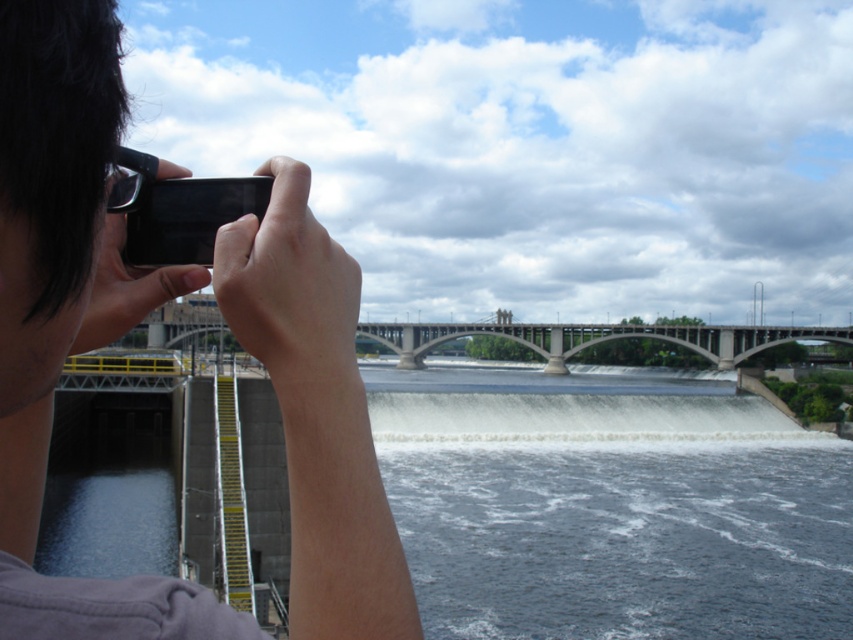
Question: In this image, where is matte black phone at upper left located relative to concrete bridge at center?

Choices:
 (A) above
 (B) below

Answer: (B)

Question: Which point appears farthest from the camera in this image?

Choices:
 (A) (49, 90)
 (B) (734, 356)

Answer: (B)

Question: Which point is closer to the camera taking this photo?

Choices:
 (A) (276, 220)
 (B) (131, 216)
 (C) (625, 328)

Answer: (A)

Question: Which object appears closest to the camera in this image?

Choices:
 (A) matte black phone at upper left
 (B) concrete bridge at center
 (C) black matte smartphone at upper left

Answer: (A)

Question: Does matte black phone at upper left appear on the right side of black matte smartphone at upper left?

Choices:
 (A) yes
 (B) no

Answer: (A)

Question: Is matte black phone at upper left wider than black matte smartphone at upper left?

Choices:
 (A) yes
 (B) no

Answer: (A)